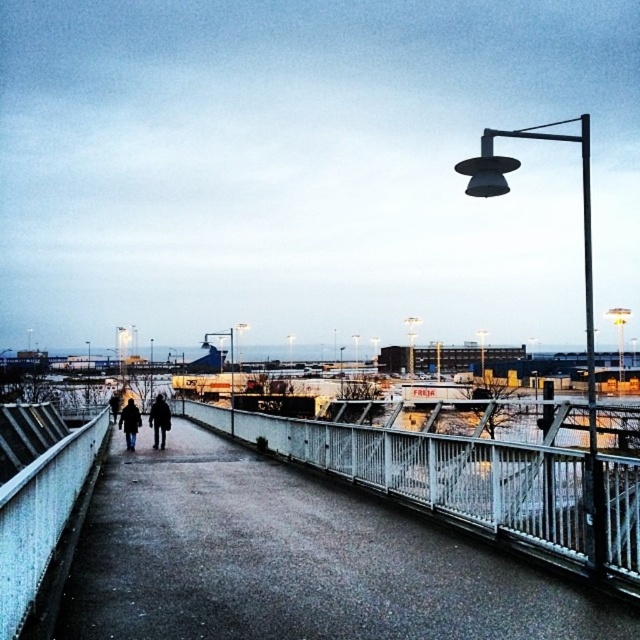
Is concrete pavement at center below dark blue coat at center?

No.

What do you see at coordinates (284, 561) in the screenshot?
I see `concrete pavement at center` at bounding box center [284, 561].

Where is `concrete pavement at center`? The height and width of the screenshot is (640, 640). concrete pavement at center is located at coordinates (284, 561).

How distant is concrete pavement at center from dark gray jacket at center?

concrete pavement at center and dark gray jacket at center are 12.73 meters apart.

Who is lower down, concrete pavement at center or dark gray jacket at center?

dark gray jacket at center

You are a GUI agent. You are given a task and a screenshot of the screen. Output one action in this format:
    pyautogui.click(x=<x>, y=<y>)
    Task: Click on the concrete pavement at center
    The height and width of the screenshot is (640, 640).
    Given the screenshot: What is the action you would take?
    pyautogui.click(x=284, y=561)

The image size is (640, 640). I want to click on concrete pavement at center, so click(x=284, y=561).

Is dark gray wool coat at center wider than dark gray jacket at center?

Indeed, dark gray wool coat at center has a greater width compared to dark gray jacket at center.

Where is `dark gray wool coat at center`? This screenshot has height=640, width=640. dark gray wool coat at center is located at coordinates (160, 420).

Locate an element on the screen. Image resolution: width=640 pixels, height=640 pixels. dark gray wool coat at center is located at coordinates (160, 420).